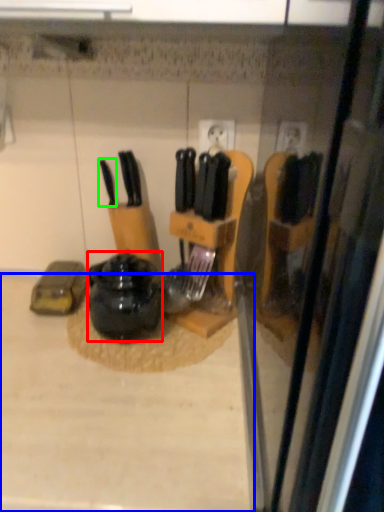
Question: Based on their relative distances, which object is farther from kitchen appliance (highlighted by a red box)? Choose from counter top (highlighted by a blue box) and knife (highlighted by a green box).

Choices:
 (A) counter top
 (B) knife

Answer: (B)